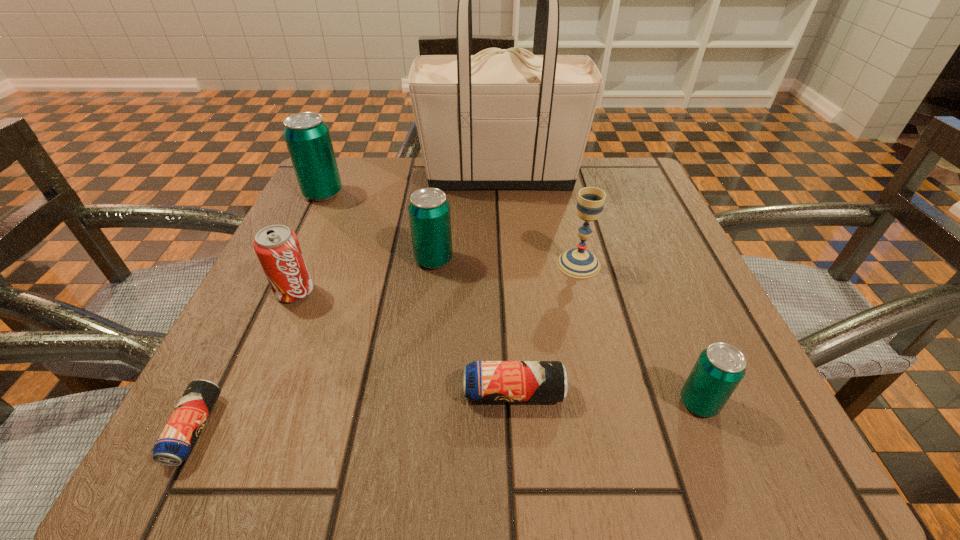
At what (x,y) coordinates should I click in order to perform the action: click on free space located 0.180m on the left of the second biggest teal beer can. Please return your answer as a coordinate pair (x, y). Looking at the image, I should click on (315, 260).

Locate an element on the screen. This screenshot has width=960, height=540. vacant space located on the front of the soda can is located at coordinates (267, 356).

Identify the location of vacant area located 0.150m on the back of the third shortest beer can. (660, 306).

Find the location of a particular element. This screenshot has width=960, height=540. free space located on the back of the bigger blue beer can is located at coordinates tap(509, 312).

What are the coordinates of `vacant space located 0.270m on the back of the left blue beer can` in the screenshot? It's located at (279, 262).

At what (x,y) coordinates should I click in order to perform the action: click on shopping bag at the far edge. Please return your answer as a coordinate pair (x, y). The height and width of the screenshot is (540, 960). Looking at the image, I should click on (506, 119).

Where is `beer can that is at the far edge`? beer can that is at the far edge is located at coordinates (307, 137).

This screenshot has width=960, height=540. Identify the location of soda can present at the left edge. (277, 247).

You are a GUI agent. You are given a task and a screenshot of the screen. Output one action in this format:
    pyautogui.click(x=<x>, y=<y>)
    Task: Click on the shopping bag located in the right edge section of the desktop
    This screenshot has width=960, height=540.
    Given the screenshot: What is the action you would take?
    pyautogui.click(x=506, y=119)

I want to click on chalice at the right edge, so click(x=578, y=262).